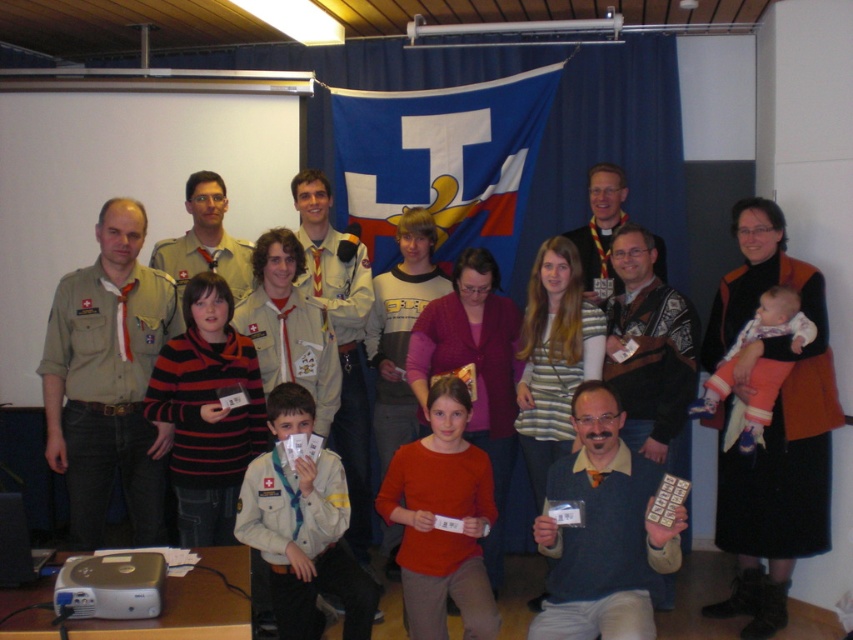
You are attending an event where you need to locate the blue fabric flag at center and the white matte uniform at center. From the perspective of someone standing in front of the group, which object is positioned higher?

The blue fabric flag at center is above the white matte uniform at center, so the blue fabric flag at center is positioned higher.

You are organizing a photo shoot and need to arrange the striped sweater at center and the matte orange sweater at center on a shelf. If the shelf has limited space, which sweater should you place first to ensure both fit?

The striped sweater at center has a lesser width compared to the matte orange sweater at center, so you should place the matte orange sweater at center first to accommodate its larger size, then the striped sweater at center will fit alongside.